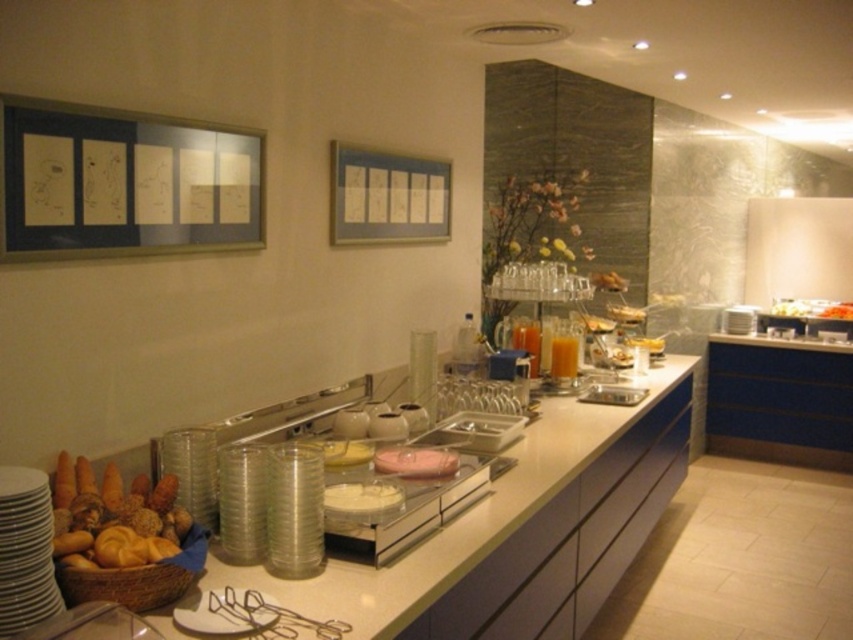
Who is more forward, [345,440] or [628,344]?

Point [345,440]

Is translucent plastic containers at center behind yellow matte bread at center?

No, it is not.

Who is more forward, (334, 460) or (659, 348)?

Positioned in front is point (334, 460).

Find the location of a particular element. translucent plastic containers at center is located at coordinates (341, 451).

Does translucent plastic containers at center come in front of translucent glass cup at center?

Yes, it is in front of translucent glass cup at center.

Measure the distance between point (346, 451) and camera.

Point (346, 451) and camera are 6.51 feet apart from each other.

Find the location of a particular element. This screenshot has height=640, width=853. translucent plastic containers at center is located at coordinates pos(341,451).

Between point (639, 433) and point (625, 339), which one is positioned behind?

Positioned behind is point (625, 339).

Is white glossy counter top at center in front of yellow matte bread at center?

Yes, white glossy counter top at center is in front of yellow matte bread at center.

Locate an element on the screen. white glossy counter top at center is located at coordinates (515, 524).